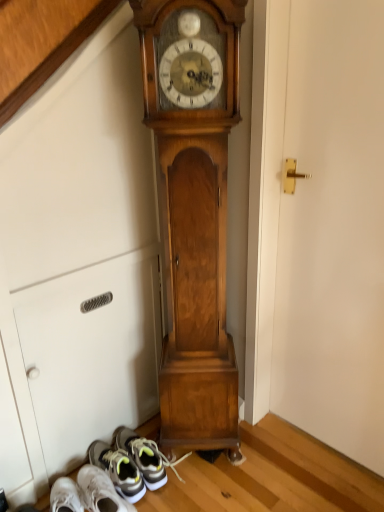
Question: Is gray fabric sneaker at lower left not close to white matte door at center right?

Choices:
 (A) no
 (B) yes

Answer: (A)

Question: Does gray fabric sneaker at lower left have a larger size compared to white matte door at center right?

Choices:
 (A) yes
 (B) no

Answer: (B)

Question: Can you confirm if gray fabric sneaker at lower left is shorter than white matte door at center right?

Choices:
 (A) yes
 (B) no

Answer: (A)

Question: Does gray fabric sneaker at lower left turn towards white matte door at center right?

Choices:
 (A) yes
 (B) no

Answer: (B)

Question: Is gray fabric sneaker at lower left closer to the viewer compared to white matte door at center right?

Choices:
 (A) no
 (B) yes

Answer: (A)

Question: In terms of size, does wooden grandfather clock at center appear bigger or smaller than gray fabric sneaker at lower left?

Choices:
 (A) small
 (B) big

Answer: (B)

Question: Considering the positions of point (175, 208) and point (56, 493), is point (175, 208) closer or farther from the camera than point (56, 493)?

Choices:
 (A) closer
 (B) farther

Answer: (A)

Question: In terms of width, does wooden grandfather clock at center look wider or thinner when compared to gray fabric sneaker at lower left?

Choices:
 (A) thin
 (B) wide

Answer: (A)

Question: Is wooden grandfather clock at center taller or shorter than gray fabric sneaker at lower left?

Choices:
 (A) short
 (B) tall

Answer: (B)

Question: From a real-world perspective, relative to white matte door at center right, is wooden grandfather clock at center vertically above or below?

Choices:
 (A) above
 (B) below

Answer: (A)

Question: Does point (215, 343) appear closer or farther from the camera than point (334, 308)?

Choices:
 (A) farther
 (B) closer

Answer: (A)

Question: Based on their sizes in the image, would you say wooden grandfather clock at center is bigger or smaller than white matte door at center right?

Choices:
 (A) small
 (B) big

Answer: (B)

Question: In the image, is wooden grandfather clock at center on the left side or the right side of white matte door at center right?

Choices:
 (A) left
 (B) right

Answer: (A)

Question: From the image's perspective, is gray fabric sneaker at lower left located above or below white matte door at center right?

Choices:
 (A) above
 (B) below

Answer: (B)

Question: Considering the positions of gray fabric sneaker at lower left and white matte door at center right in the image, is gray fabric sneaker at lower left bigger or smaller than white matte door at center right?

Choices:
 (A) small
 (B) big

Answer: (A)